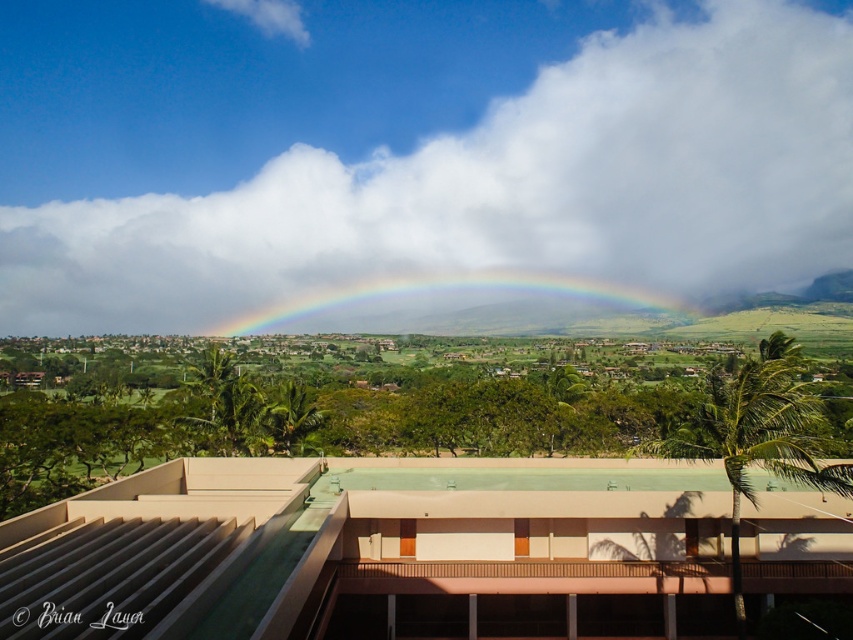
Question: Which point is closer to the camera taking this photo?

Choices:
 (A) (842, 68)
 (B) (497, 285)
 (C) (198, 529)
 (D) (737, 493)

Answer: (D)

Question: Which of the following is the farthest from the observer?

Choices:
 (A) rainbow at center
 (B) green leafy palm tree at center-right
 (C) white fluffy cloud at upper center
 (D) beige concrete balcony at center

Answer: (C)

Question: Is white fluffy cloud at upper center bigger than rainbow at center?

Choices:
 (A) no
 (B) yes

Answer: (B)

Question: Does beige concrete balcony at center have a smaller size compared to green leafy palm tree at center-right?

Choices:
 (A) yes
 (B) no

Answer: (A)

Question: Considering the relative positions of white fluffy cloud at upper center and rainbow at center in the image provided, where is white fluffy cloud at upper center located with respect to rainbow at center?

Choices:
 (A) above
 (B) below

Answer: (A)

Question: Based on their relative distances, which object is farther from the white fluffy cloud at upper center?

Choices:
 (A) rainbow at center
 (B) green leafy palm tree at center-right
 (C) beige concrete balcony at center

Answer: (B)